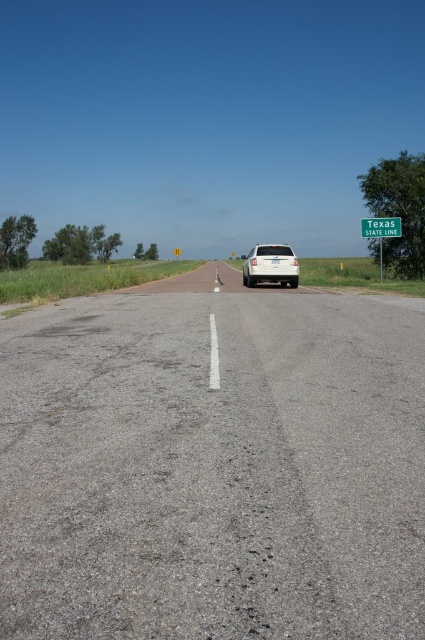
Does gray asphalt road at center have a greater width compared to green plastic sign at upper right?

In fact, gray asphalt road at center might be narrower than green plastic sign at upper right.

Does gray asphalt road at center have a greater height compared to green plastic sign at upper right?

No, gray asphalt road at center is not taller than green plastic sign at upper right.

I want to click on gray asphalt road at center, so click(212, 465).

Identify the location of gray asphalt road at center. The image size is (425, 640). (212, 465).

Does gray asphalt road at center have a smaller size compared to green metallic sign at upper right?

Indeed, gray asphalt road at center has a smaller size compared to green metallic sign at upper right.

Is point (319, 438) in front of point (373, 234)?

That is True.

You are a GUI agent. You are given a task and a screenshot of the screen. Output one action in this format:
    pyautogui.click(x=<x>, y=<y>)
    Task: Click on the gray asphalt road at center
    
    Given the screenshot: What is the action you would take?
    pyautogui.click(x=212, y=465)

Identify the location of gray asphalt road at center. Image resolution: width=425 pixels, height=640 pixels. (212, 465).

Locate an element on the screen. Image resolution: width=425 pixels, height=640 pixels. gray asphalt road at center is located at coordinates (212, 465).